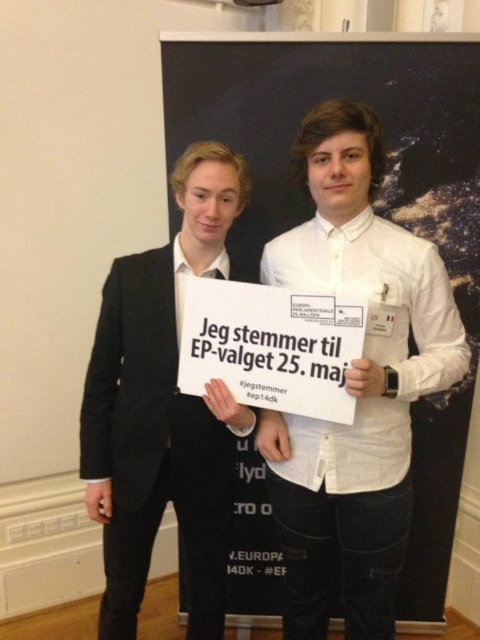
Based on the coordinates provided, which object is located at point (355,385)?

The white cotton shirt at center is located at point (355,385).

You are a photographer trying to capture a clear photo of the sign held by two people. You notice the white cotton shirt at center and the black matte suit at center. Which clothing item might block the view of the sign in your photo?

The white cotton shirt at center is in front of the black matte suit at center, so it might block the view of the sign in your photo.